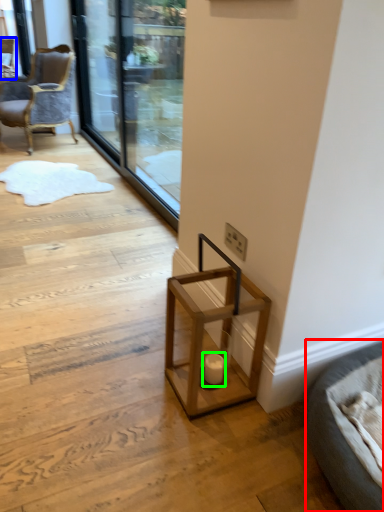
Question: Which object is the closest to the furniture (highlighted by a red box)? Choose among these: chair (highlighted by a blue box) or candle holder (highlighted by a green box).

Choices:
 (A) chair
 (B) candle holder

Answer: (B)